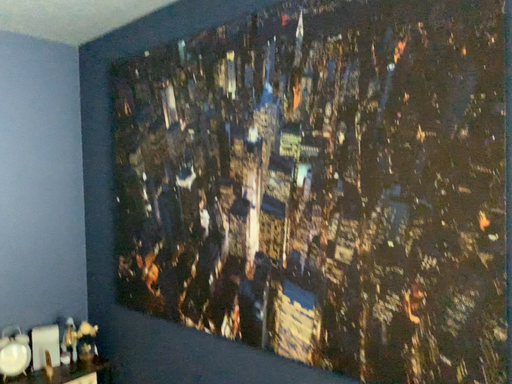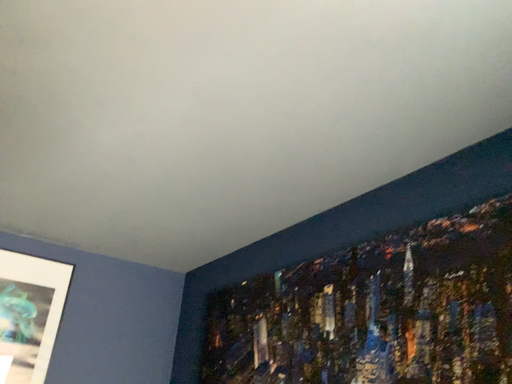
Question: Which way did the camera rotate in the video?

Choices:
 (A) rotated downward
 (B) rotated upward

Answer: (B)